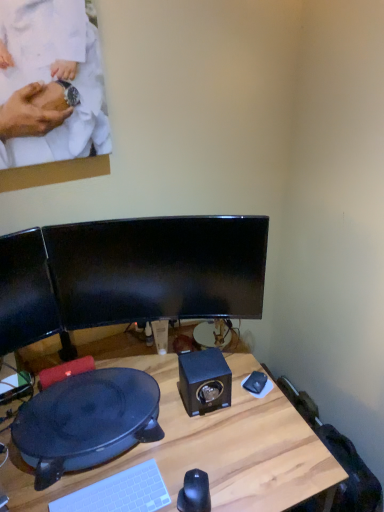
Where is `free space to the left of black matte speaker at center`? The image size is (384, 512). free space to the left of black matte speaker at center is located at coordinates (160, 398).